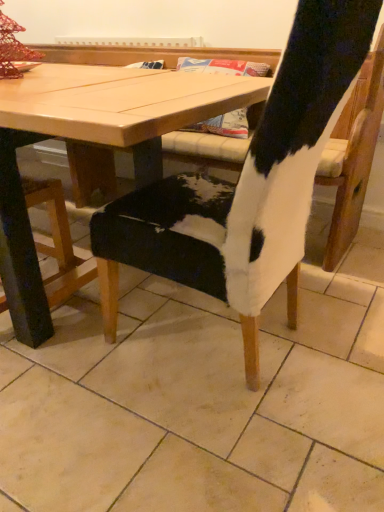
The height and width of the screenshot is (512, 384). Identify the location of wooden table at center. (94, 144).

Describe the element at coordinates (200, 400) in the screenshot. Image resolution: width=384 pixels, height=512 pixels. I see `cowhide chair at center` at that location.

Locate an element on the screen. The image size is (384, 512). cowhide chair at center is located at coordinates (200, 400).

In order to click on cowhide chair at center in this screenshot , I will do `click(251, 182)`.

Which is correct: cowhide chair at center is inside wooden table at center, or outside of it?

cowhide chair at center is enclosed within wooden table at center.

Which object is closer to the camera taking this photo, cowhide chair at center or wooden table at center?

cowhide chair at center is in front.

Considering the positions of point (277, 205) and point (171, 130), is point (277, 205) closer or farther from the camera than point (171, 130)?

Clearly, point (277, 205) is more distant from the camera than point (171, 130).

From a real-world perspective, is cowhide chair at center located higher than wooden table at center?

Yes.

This screenshot has width=384, height=512. Find the location of `chair to the right of wooden table at center`. chair to the right of wooden table at center is located at coordinates (251, 182).

Is wooden table at center thinner than cowhide chair at center?

In fact, wooden table at center might be wider than cowhide chair at center.

In the scene shown: Would you say wooden table at center is outside cowhide chair at center?

Yes.

Considering their positions, is cowhide chair at center located in front of or behind cowhide chair at center?

In the image, cowhide chair at center appears in front of cowhide chair at center.

From the picture: Considering the positions of objects cowhide chair at center and cowhide chair at center in the image provided, who is more to the left, cowhide chair at center or cowhide chair at center?

From the viewer's perspective, cowhide chair at center appears more on the left side.

Consider the image. Would you say cowhide chair at center contains cowhide chair at center?

Actually, cowhide chair at center is outside cowhide chair at center.

Find the location of a particular element. chair on the left of cowhide chair at center is located at coordinates point(251,182).

Does cowhide chair at center turn towards wooden table at center?

No, cowhide chair at center is not aimed at wooden table at center.

Can you tell me how much cowhide chair at center and wooden table at center differ in facing direction?

89.8 degrees separate the facing orientations of cowhide chair at center and wooden table at center.

Can you confirm if cowhide chair at center is thinner than wooden table at center?

No, cowhide chair at center is not thinner than wooden table at center.

Would you say cowhide chair at center is inside or outside wooden table at center?

cowhide chair at center is located beyond the bounds of wooden table at center.

Is the depth of cowhide chair at center less than that of cowhide chair at center?

No, it is behind cowhide chair at center.

Is cowhide chair at center turned away from cowhide chair at center?

That's not correct — cowhide chair at center is not looking away from cowhide chair at center.

Which object is wider, cowhide chair at center or cowhide chair at center?

Wider between the two is cowhide chair at center.

What's the angular difference between cowhide chair at center and cowhide chair at center's facing directions?

There is a 180-degree angle between the facing directions of cowhide chair at center and cowhide chair at center.

Locate an element on the screen. Image resolution: width=384 pixels, height=512 pixels. table on the left side of cowhide chair at center is located at coordinates (94, 144).

Does wooden table at center come behind cowhide chair at center?

Yes, it is.

From the image's perspective, between wooden table at center and cowhide chair at center, which one is located above?

wooden table at center appears higher in the image.

Does wooden table at center touch cowhide chair at center?

They are not placed beside each other.

Image resolution: width=384 pixels, height=512 pixels. In order to click on chair that is in front of the wooden table at center in this screenshot , I will do `click(251, 182)`.

Where is `chair lying on the right of wooden table at center`? chair lying on the right of wooden table at center is located at coordinates (251, 182).

Considering their positions, is cowhide chair at center positioned closer to cowhide chair at center than wooden table at center?

cowhide chair at center.

Estimate the real-world distances between objects in this image. Which object is further from cowhide chair at center, cowhide chair at center or wooden table at center?

The object further to cowhide chair at center is cowhide chair at center.

Based on their spatial positions, is cowhide chair at center or cowhide chair at center closer to wooden table at center?

Among the two, cowhide chair at center is located nearer to wooden table at center.

Considering their positions, is cowhide chair at center positioned closer to wooden table at center than cowhide chair at center?

The object closer to wooden table at center is cowhide chair at center.

Based on their spatial positions, is wooden table at center or cowhide chair at center closer to cowhide chair at center?

cowhide chair at center lies closer to cowhide chair at center than the other object.

From the picture: Looking at the image, which one is located closer to cowhide chair at center, wooden table at center or cowhide chair at center?

wooden table at center.

At what (x,y) coordinates should I click in order to perform the action: click on chair between wooden table at center and cowhide chair at center. Please return your answer as a coordinate pair (x, y). The height and width of the screenshot is (512, 384). Looking at the image, I should click on (251, 182).